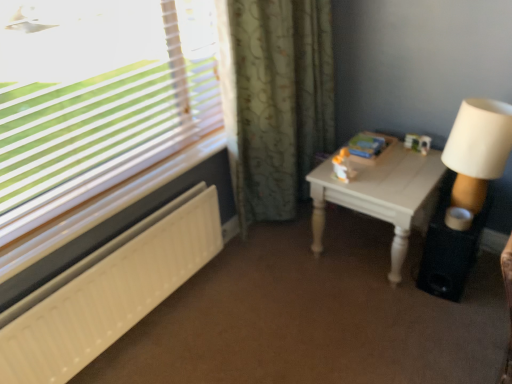
Find the location of a particular element. vacant area that is in front of white wood table at right is located at coordinates (376, 323).